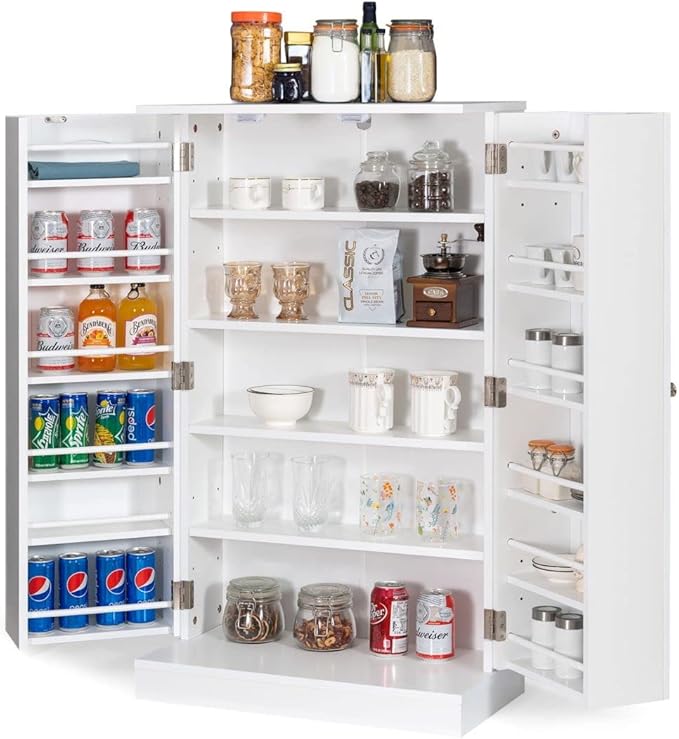
Locate an element on the screen. hinges is located at coordinates (181, 588), (490, 619), (491, 160), (490, 395), (182, 378), (183, 146).